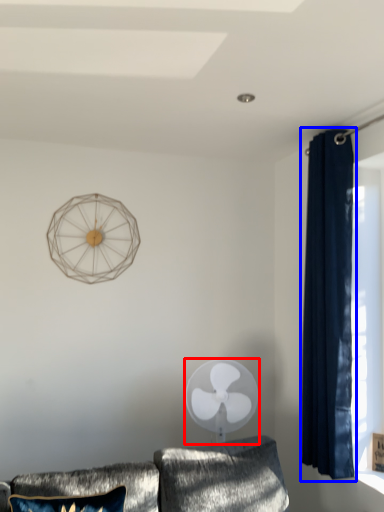
Question: Which object is further to the camera taking this photo, mechanical fan (highlighted by a red box) or curtain (highlighted by a blue box)?

Choices:
 (A) mechanical fan
 (B) curtain

Answer: (A)